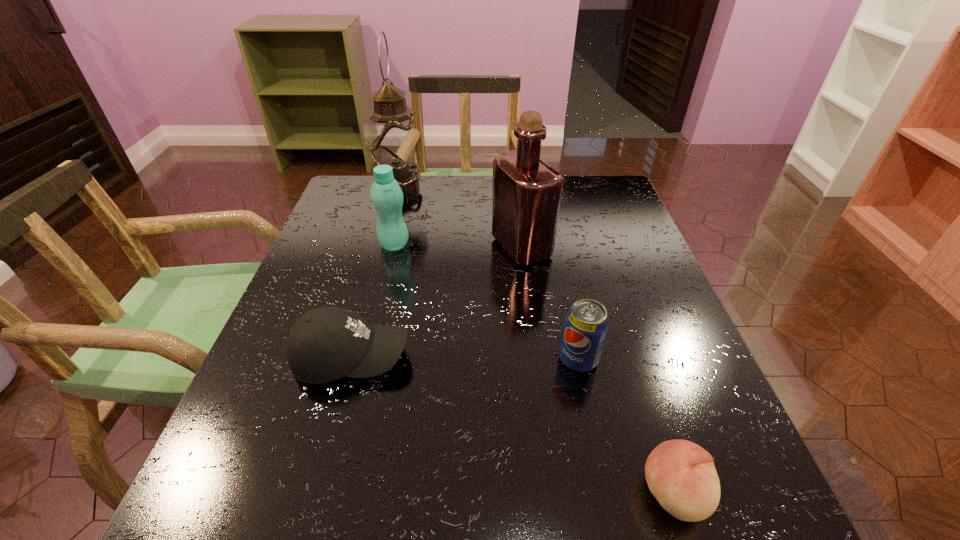
Where is `free location that satisfies the following two spatial constraints: 1. on the front side of the third tallest object; 2. on the front-facing side of the baseball cap`? The width and height of the screenshot is (960, 540). free location that satisfies the following two spatial constraints: 1. on the front side of the third tallest object; 2. on the front-facing side of the baseball cap is located at coordinates (367, 358).

Identify the location of blank space that satisfies the following two spatial constraints: 1. on the front side of the fourth shortest object; 2. on the right side of the second tallest object. This screenshot has height=540, width=960. (394, 247).

This screenshot has height=540, width=960. Find the location of `vacant region that satisfies the following two spatial constraints: 1. on the front side of the liquor; 2. on the front-facing side of the baseball cap`. vacant region that satisfies the following two spatial constraints: 1. on the front side of the liquor; 2. on the front-facing side of the baseball cap is located at coordinates (535, 358).